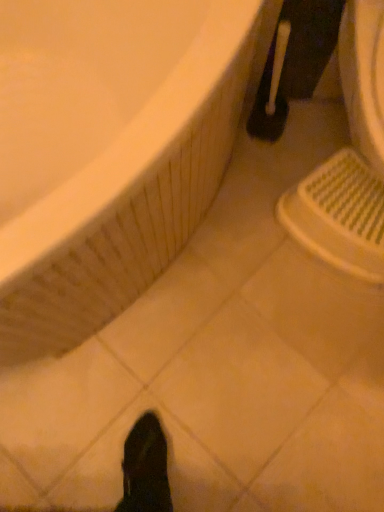
Question: From a real-world perspective, is white glossy bathtub at upper left located higher than black plastic toilet brush at upper right?

Choices:
 (A) yes
 (B) no

Answer: (A)

Question: Is white glossy bathtub at upper left shorter than black plastic toilet brush at upper right?

Choices:
 (A) no
 (B) yes

Answer: (A)

Question: Does white glossy bathtub at upper left lie in front of black plastic toilet brush at upper right?

Choices:
 (A) yes
 (B) no

Answer: (A)

Question: Is white glossy bathtub at upper left turned away from black plastic toilet brush at upper right?

Choices:
 (A) no
 (B) yes

Answer: (A)

Question: Is white glossy bathtub at upper left taller than black plastic toilet brush at upper right?

Choices:
 (A) no
 (B) yes

Answer: (B)

Question: Is white glossy bathtub at upper left in contact with black plastic toilet brush at upper right?

Choices:
 (A) no
 (B) yes

Answer: (A)

Question: Is the position of white glossy bathtub at upper left more distant than that of white plastic sink at lower right?

Choices:
 (A) no
 (B) yes

Answer: (A)

Question: Can you confirm if white glossy bathtub at upper left is wider than white plastic sink at lower right?

Choices:
 (A) yes
 (B) no

Answer: (A)

Question: From the image's perspective, is white glossy bathtub at upper left on top of white plastic sink at lower right?

Choices:
 (A) no
 (B) yes

Answer: (A)

Question: Is white glossy bathtub at upper left at the right side of white plastic sink at lower right?

Choices:
 (A) yes
 (B) no

Answer: (B)

Question: Can white plastic sink at lower right be found inside white glossy bathtub at upper left?

Choices:
 (A) yes
 (B) no

Answer: (B)

Question: Considering the relative sizes of white glossy bathtub at upper left and white plastic sink at lower right in the image provided, is white glossy bathtub at upper left thinner than white plastic sink at lower right?

Choices:
 (A) yes
 (B) no

Answer: (B)

Question: From a real-world perspective, is white plastic sink at lower right positioned over white glossy bathtub at upper left based on gravity?

Choices:
 (A) no
 (B) yes

Answer: (A)